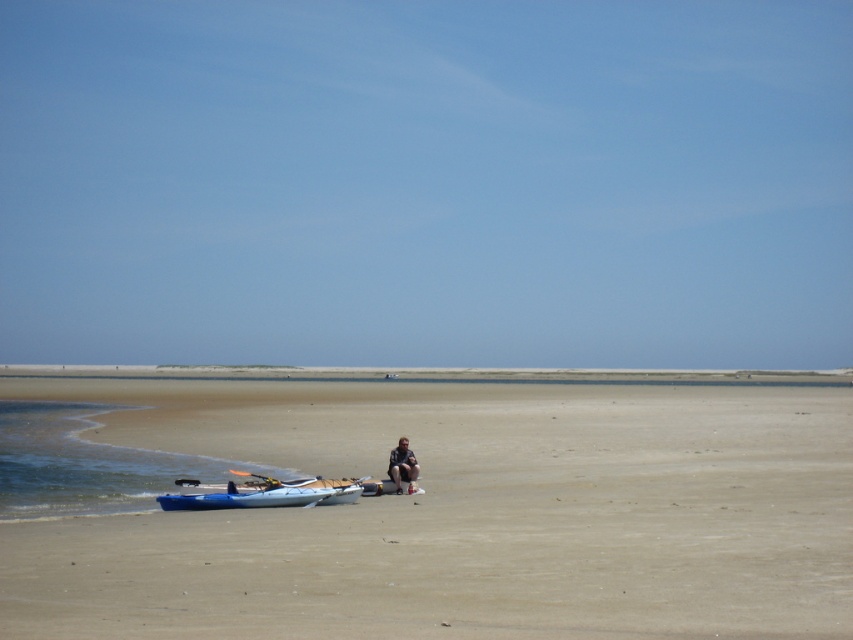
Question: Which point is closer to the camera?

Choices:
 (A) (180, 500)
 (B) (786, 490)

Answer: (A)

Question: Can you confirm if blue plastic kayak at lower left is wider than dark gray fabric pants at center?

Choices:
 (A) no
 (B) yes

Answer: (B)

Question: Which of the following is the closest to the observer?

Choices:
 (A) (396, 488)
 (B) (799, 444)
 (C) (288, 492)

Answer: (C)

Question: Which point is closer to the camera?

Choices:
 (A) blue plastic kayak at lower left
 (B) beige sand at center
 (C) dark gray fabric pants at center

Answer: (B)

Question: Can you confirm if blue plastic kayak at lower left is wider than dark gray fabric pants at center?

Choices:
 (A) yes
 (B) no

Answer: (A)

Question: Can you confirm if beige sand at center is wider than blue plastic kayak at lower left?

Choices:
 (A) yes
 (B) no

Answer: (A)